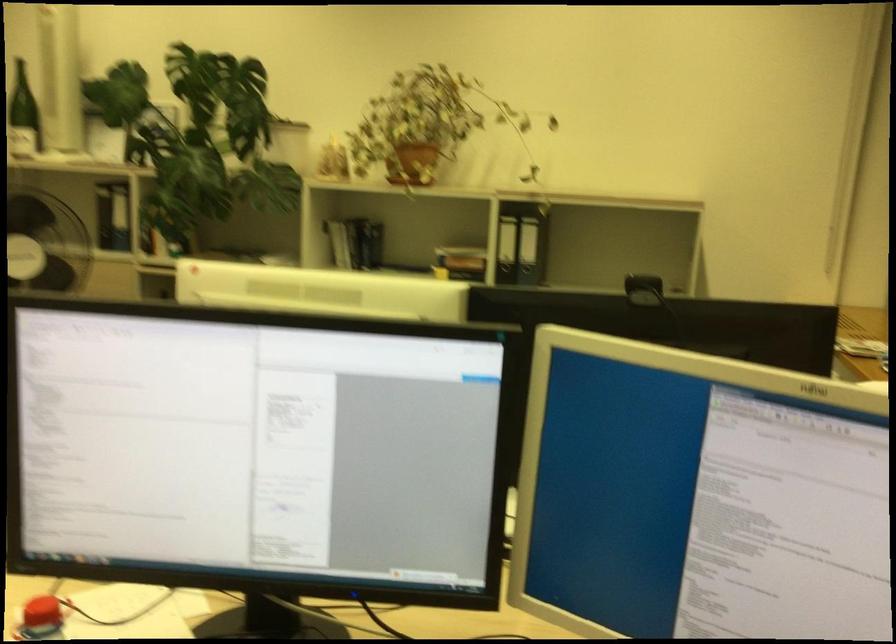
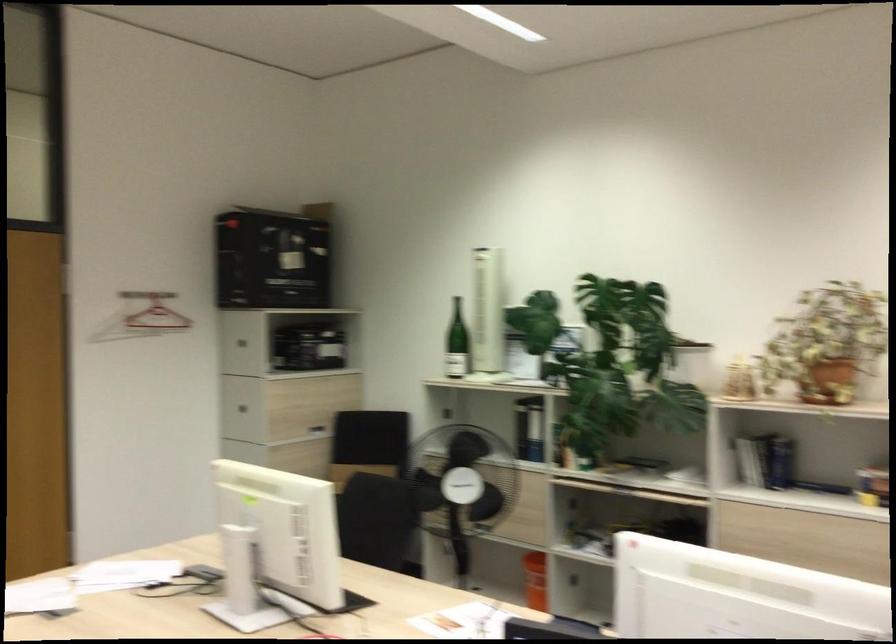
Question: The images are taken continuously from a first-person perspective. In which direction is your viewpoint rotating?

Choices:
 (A) Left
 (B) Right
 (C) Up
 (D) Down

Answer: (A)